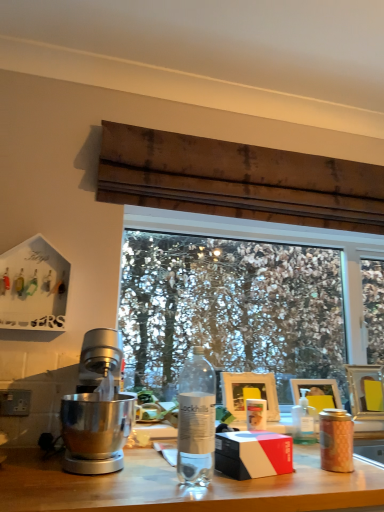
Question: Is wooden picture frame at right, the second picture frame when ordered from left to right, wider than transparent glass window at center?

Choices:
 (A) yes
 (B) no

Answer: (A)

Question: From the image's perspective, is wooden picture frame at right, arranged as the 2th picture frame when viewed from the right, on transparent glass window at center?

Choices:
 (A) no
 (B) yes

Answer: (A)

Question: Can you confirm if wooden picture frame at right, arranged as the 2th picture frame when viewed from the right, is smaller than transparent glass window at center?

Choices:
 (A) yes
 (B) no

Answer: (A)

Question: Is wooden picture frame at right, the second picture frame when ordered from left to right, not inside transparent glass window at center?

Choices:
 (A) no
 (B) yes

Answer: (B)

Question: From a real-world perspective, is wooden picture frame at right, arranged as the 2th picture frame when viewed from the right, located beneath transparent glass window at center?

Choices:
 (A) yes
 (B) no

Answer: (A)

Question: Does wooden picture frame at right, arranged as the 2th picture frame when viewed from the right, have a larger size compared to transparent glass window at center?

Choices:
 (A) yes
 (B) no

Answer: (B)

Question: Is polished silver mixer at left not within pink matte coffee cup at center, the 2th coffee cup from the right?

Choices:
 (A) yes
 (B) no

Answer: (A)

Question: Is polished silver mixer at left aimed at pink matte coffee cup at center, which ranks as the second coffee cup in front-to-back order?

Choices:
 (A) yes
 (B) no

Answer: (B)

Question: Can you confirm if polished silver mixer at left is wider than pink matte coffee cup at center, which ranks as the second coffee cup in front-to-back order?

Choices:
 (A) no
 (B) yes

Answer: (B)

Question: From the image's perspective, is polished silver mixer at left under pink matte coffee cup at center, arranged as the 1th coffee cup when viewed from the left?

Choices:
 (A) yes
 (B) no

Answer: (B)

Question: From a real-world perspective, is polished silver mixer at left located beneath pink matte coffee cup at center, arranged as the 1th coffee cup when viewed from the left?

Choices:
 (A) no
 (B) yes

Answer: (A)

Question: Can you confirm if polished silver mixer at left is positioned to the left of pink matte coffee cup at center, which ranks as the second coffee cup in front-to-back order?

Choices:
 (A) no
 (B) yes

Answer: (B)

Question: Could you tell me if polished silver mixer at left is turned towards clear plastic bottle at center, the 1th bottle in the back-to-front sequence?

Choices:
 (A) yes
 (B) no

Answer: (B)